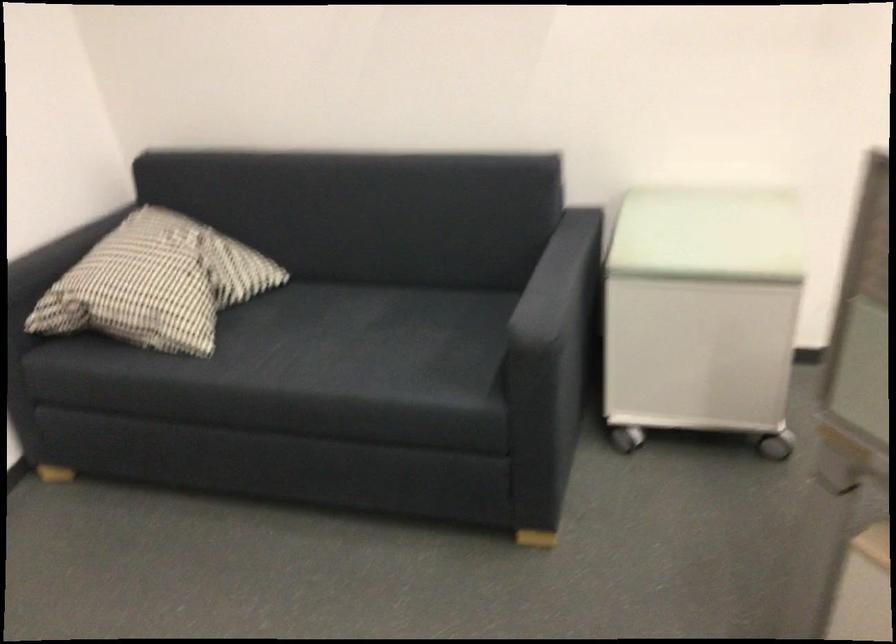
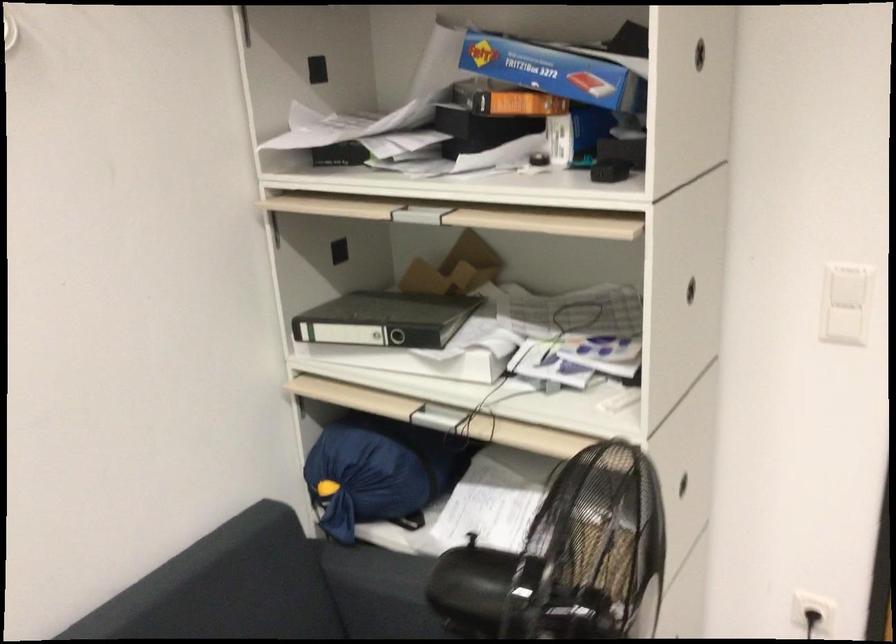
First-person continuous shooting, in which direction is the camera rotating?

The camera's rotation is toward left-down.